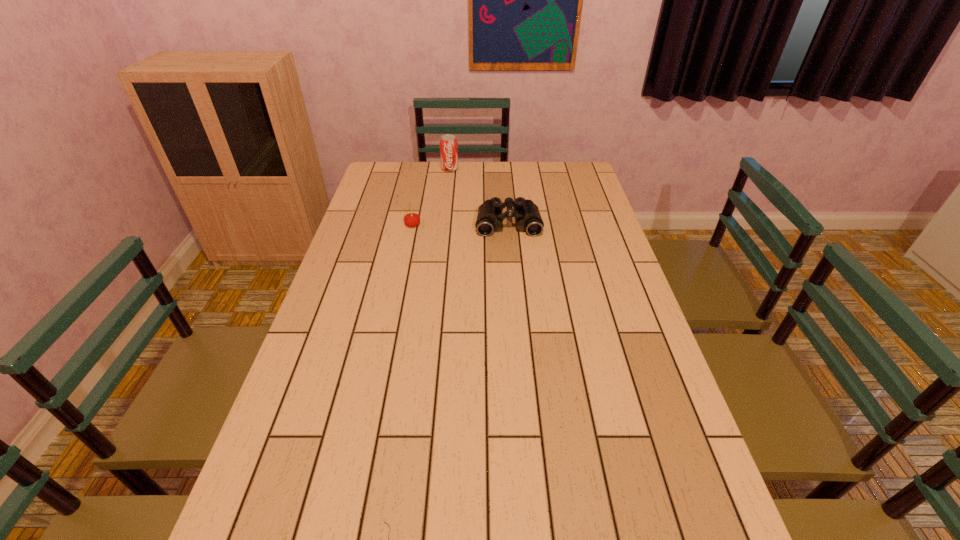
Identify the location of the tallest object. This screenshot has width=960, height=540. click(x=448, y=143).

Where is `the farthest object`? The height and width of the screenshot is (540, 960). the farthest object is located at coordinates (448, 143).

The height and width of the screenshot is (540, 960). What are the coordinates of `cherry` in the screenshot? It's located at (412, 219).

The image size is (960, 540). I want to click on binoculars, so click(x=490, y=218).

Locate an element on the screen. vacant point located 0.220m on the logo side of the farthest object is located at coordinates (446, 201).

This screenshot has width=960, height=540. In order to click on free space located 0.200m on the right of the leftmost object in this screenshot , I will do `click(478, 225)`.

Locate an element on the screen. vacant area situated 0.360m on the front-facing side of the binoculars is located at coordinates (516, 314).

The height and width of the screenshot is (540, 960). I want to click on object located at the far edge, so click(x=448, y=143).

In the image, there is a desktop. Where is `vacant space at the far edge`? The image size is (960, 540). vacant space at the far edge is located at coordinates (450, 173).

I want to click on blank space at the left edge, so click(x=349, y=273).